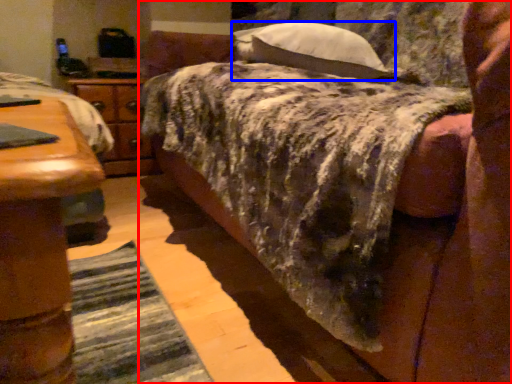
Question: Which of the following is the closest to the observer, bed (highlighted by a red box) or pillow (highlighted by a blue box)?

Choices:
 (A) bed
 (B) pillow

Answer: (A)